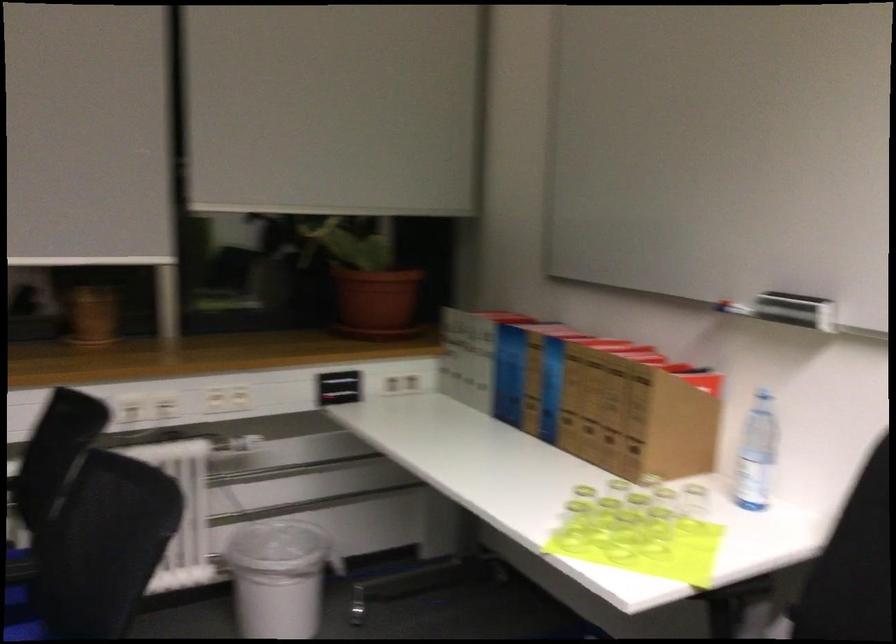
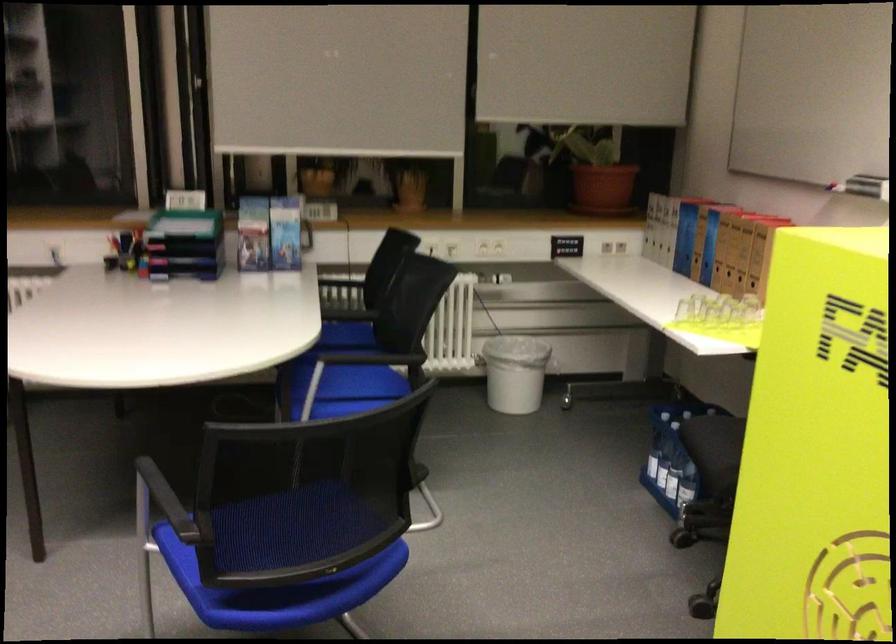
Where in the second image is the point corresponding to [605,514] from the first image?

(713, 310)